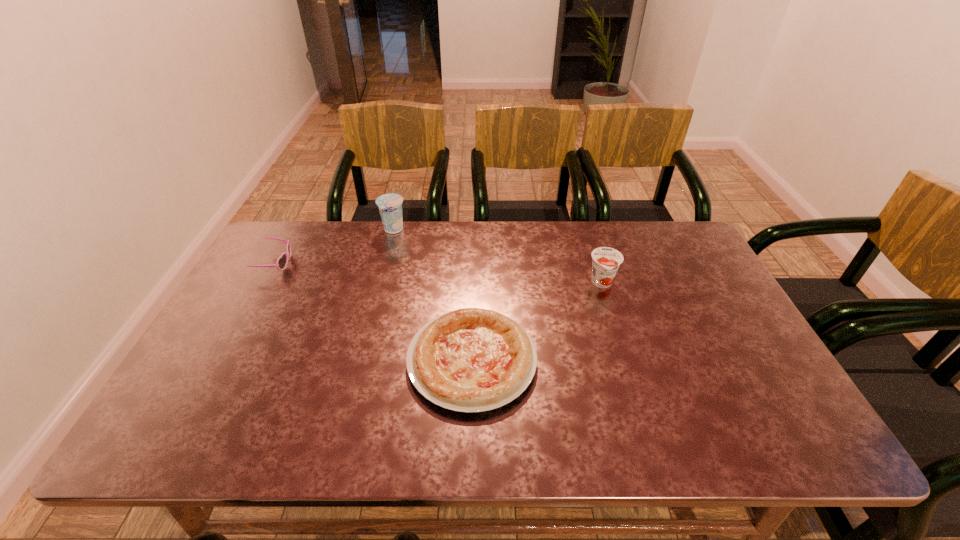
Find the location of a particular element. Image resolution: width=960 pixels, height=540 pixels. vacant area at the far left corner is located at coordinates (276, 254).

In the image, there is a desktop. Find the location of `free region at the near right corner`. free region at the near right corner is located at coordinates (732, 429).

At what (x,y) coordinates should I click in order to perform the action: click on free space between the leftmost object and the nearest object. Please return your answer as a coordinate pair (x, y). Looking at the image, I should click on (373, 312).

Find the location of a particular element. The width and height of the screenshot is (960, 540). unoccupied area between the second object from left to right and the rightmost object is located at coordinates (497, 256).

This screenshot has height=540, width=960. In order to click on vacant area that lies between the farthest object and the leftmost object in this screenshot , I will do `click(334, 246)`.

Image resolution: width=960 pixels, height=540 pixels. I want to click on blank region between the farthest object and the sunglasses, so click(x=334, y=246).

This screenshot has width=960, height=540. I want to click on vacant area between the second tallest object and the third object from left to right, so click(x=537, y=322).

Where is `unoccupied position between the nearest object and the tallest object`? unoccupied position between the nearest object and the tallest object is located at coordinates (433, 295).

This screenshot has width=960, height=540. Identify the location of free space between the right yogurt and the sunglasses. (439, 273).

Identify the location of free area in between the sunglasses and the left yogurt. (334, 246).